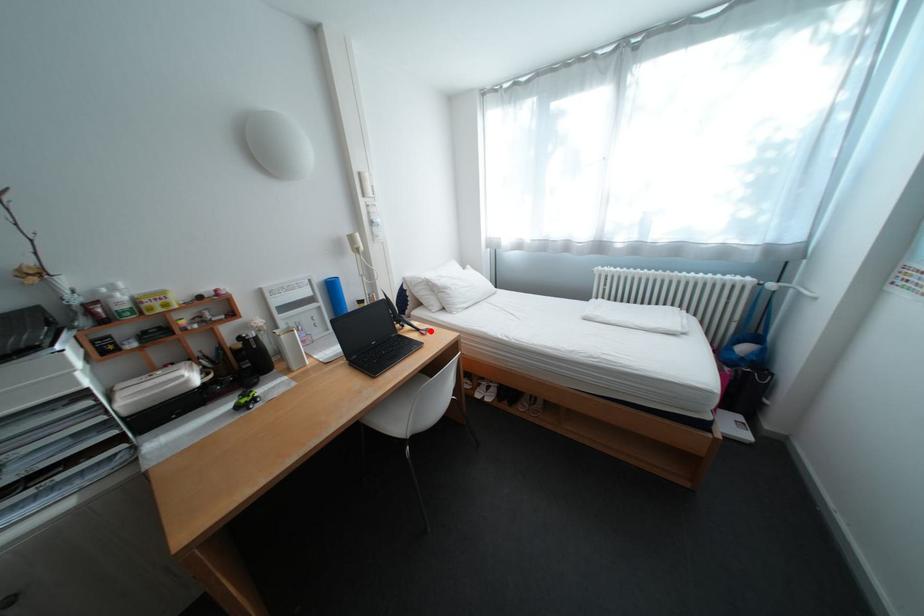
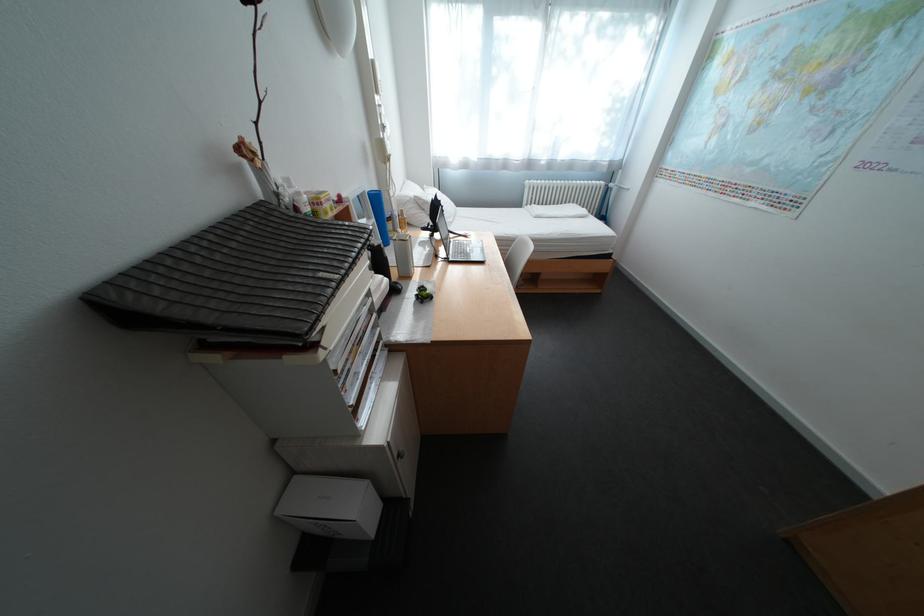
Where in the second image is the point corresponding to the highlighted location from the first image?

(472, 236)